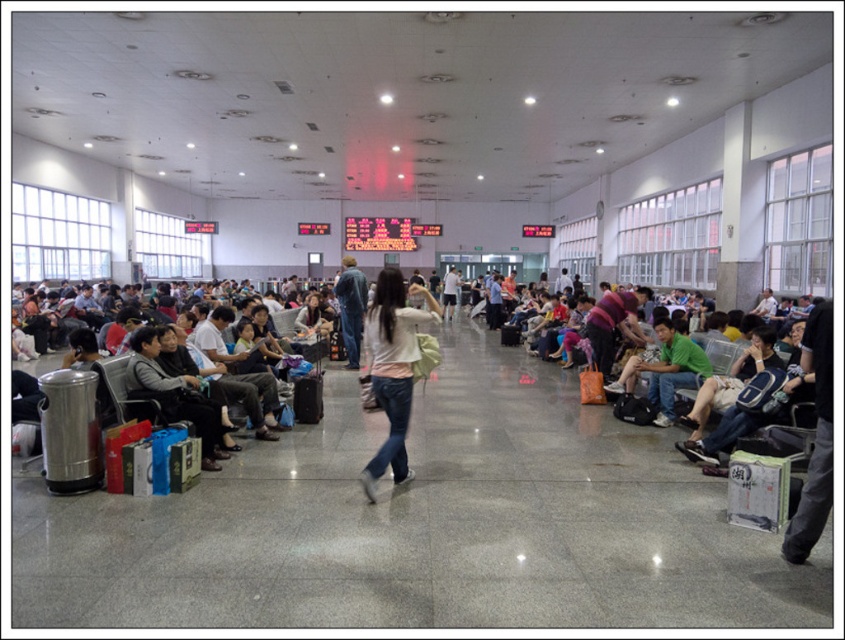
You are standing in the waiting area and notice a person wearing an object. Where exactly is the white matte shirt at center located in the room?

The white matte shirt at center is located at point coordinates (391, 369).

You are standing at point (295,410) and want to walk to point (373,369). Which direction should you move to reach your destination?

You should move forward because point (373,369) is in front of point (295,410).